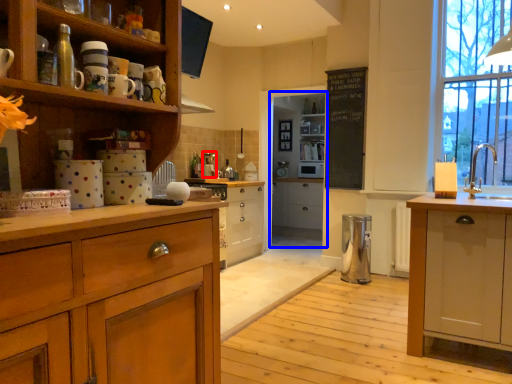
Question: Among these objects, which one is nearest to the camera, coffee machine (highlighted by a red box) or cabinetry (highlighted by a blue box)?

Choices:
 (A) coffee machine
 (B) cabinetry

Answer: (A)